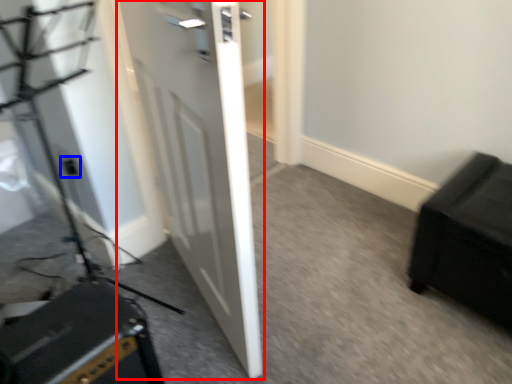
Question: Among these objects, which one is farthest to the camera, door (highlighted by a red box) or electric outlet (highlighted by a blue box)?

Choices:
 (A) door
 (B) electric outlet

Answer: (B)